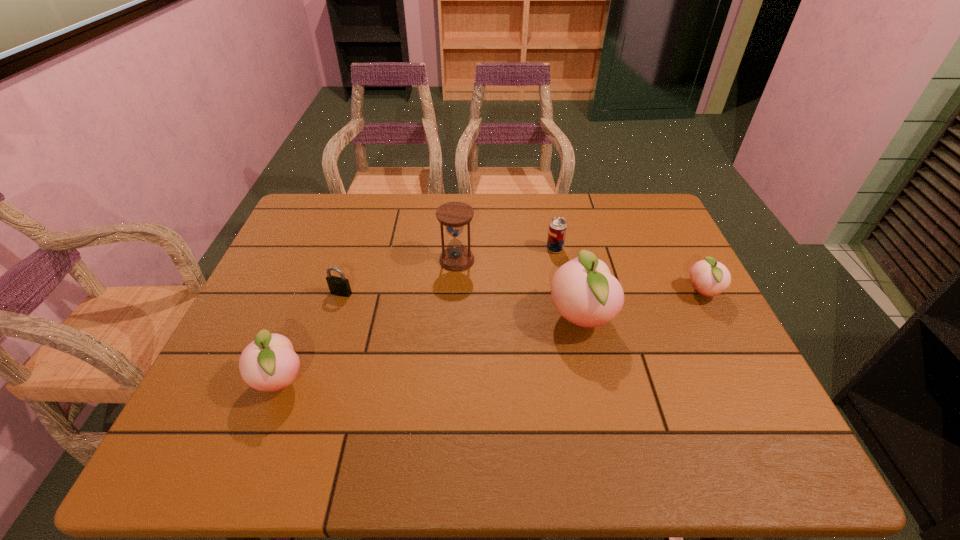
Where is `free space between the leftmost peach and the second tallest object`? Image resolution: width=960 pixels, height=540 pixels. free space between the leftmost peach and the second tallest object is located at coordinates (369, 320).

At what (x,y) coordinates should I click in order to perform the action: click on free space between the rightmost object and the padlock. Please return your answer as a coordinate pair (x, y). The width and height of the screenshot is (960, 540). Looking at the image, I should click on (522, 293).

Image resolution: width=960 pixels, height=540 pixels. Identify the location of vacant area that lies between the beer can and the leftmost peach. (418, 315).

Locate an element on the screen. The image size is (960, 540). the fourth closest object to the fourth object from right to left is located at coordinates pos(269,363).

Locate an element on the screen. the fourth closest object to the padlock is located at coordinates (557, 228).

At what (x,y) coordinates should I click in order to perform the action: click on peach that is the second closest to the leftmost peach. Please return your answer as a coordinate pair (x, y). Looking at the image, I should click on (710, 278).

In order to click on the second closest peach to the padlock in this screenshot , I will do `click(584, 292)`.

At what (x,y) coordinates should I click in order to perform the action: click on blank space that satisfies the following two spatial constraints: 1. on the back side of the hourglass; 2. on the left side of the beer can. Please return your answer as a coordinate pair (x, y). Looking at the image, I should click on (458, 249).

Find the location of a particular element. The image size is (960, 540). vacant space that satisfies the following two spatial constraints: 1. on the front side of the second peach from left to right; 2. on the left side of the padlock is located at coordinates (333, 319).

Identify the location of blank space that satisfies the following two spatial constraints: 1. on the back side of the shortest peach; 2. on the right side of the leftmost peach. This screenshot has height=540, width=960. (315, 293).